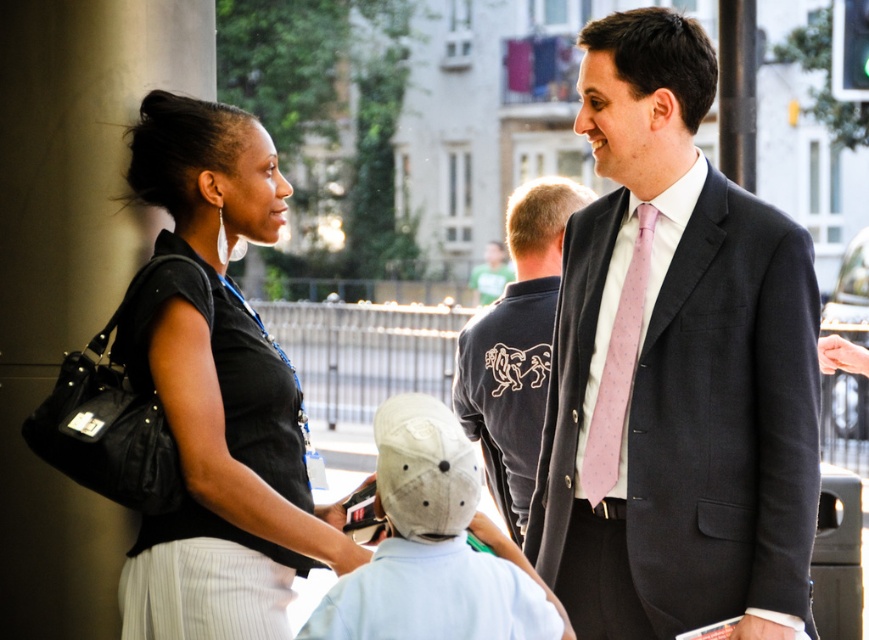
Does black fabric shirt at left appear under pink silk tie at right?

Incorrect, black fabric shirt at left is not positioned below pink silk tie at right.

This screenshot has width=869, height=640. I want to click on black fabric shirt at left, so click(x=217, y=392).

This screenshot has height=640, width=869. I want to click on black fabric shirt at left, so click(x=217, y=392).

Between light gray cotton cap at center and dark blue shirt at center, which one appears on the left side from the viewer's perspective?

light gray cotton cap at center is more to the left.

The image size is (869, 640). In order to click on light gray cotton cap at center in this screenshot , I will do `click(434, 547)`.

Between dark gray suit at right and pink silk tie at right, which one is positioned higher?

dark gray suit at right is higher up.

Is dark gray suit at right positioned before pink silk tie at right?

That is True.

This screenshot has height=640, width=869. In order to click on dark gray suit at right in this screenshot , I will do `click(675, 369)`.

Identify the location of dark gray suit at right. (675, 369).